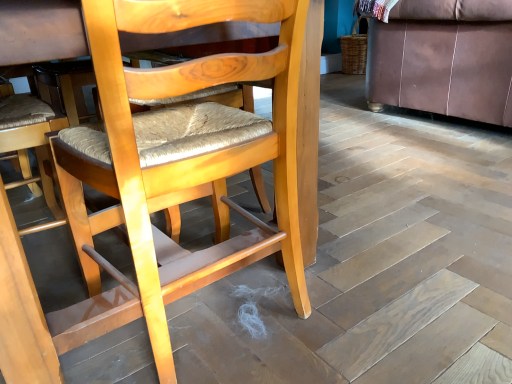
Image resolution: width=512 pixels, height=384 pixels. What do you see at coordinates (444, 59) in the screenshot?
I see `brown leather couch at right` at bounding box center [444, 59].

Locate an element on the screen. Image resolution: width=512 pixels, height=384 pixels. brown leather couch at right is located at coordinates (444, 59).

The width and height of the screenshot is (512, 384). In order to click on light brown wood chair at center in this screenshot , I will do `click(168, 180)`.

Measure the distance between point (139, 19) and camera.

A distance of 58.60 centimeters exists between point (139, 19) and camera.

Describe the element at coordinates (168, 180) in the screenshot. I see `light brown wood chair at center` at that location.

This screenshot has width=512, height=384. What are the coordinates of `brown leather couch at right` in the screenshot? It's located at (x=444, y=59).

Based on the photo, considering the positions of objects brown leather couch at right and light brown wood chair at center in the image provided, who is more to the right, brown leather couch at right or light brown wood chair at center?

brown leather couch at right.

From the picture: Which object is more forward, brown leather couch at right or light brown wood chair at center?

Positioned in front is light brown wood chair at center.

Which is closer to the camera, (x=432, y=77) or (x=293, y=94)?

Positioned in front is point (x=293, y=94).

From the image's perspective, is brown leather couch at right over light brown wood chair at center?

Correct, brown leather couch at right appears higher than light brown wood chair at center in the image.

In the scene shown: From a real-world perspective, is brown leather couch at right on light brown wood chair at center?

Yes, from a real-world perspective, brown leather couch at right is on top of light brown wood chair at center.

Is brown leather couch at right wider than light brown wood chair at center?

Indeed, brown leather couch at right has a greater width compared to light brown wood chair at center.

Between brown leather couch at right and light brown wood chair at center, which one has less height?

Standing shorter between the two is brown leather couch at right.

Can you confirm if brown leather couch at right is bigger than light brown wood chair at center?

Indeed, brown leather couch at right has a larger size compared to light brown wood chair at center.

Can we say brown leather couch at right lies outside light brown wood chair at center?

Yes, brown leather couch at right is located beyond the bounds of light brown wood chair at center.

From the picture: Is the surface of brown leather couch at right in direct contact with light brown wood chair at center?

No, brown leather couch at right is not with light brown wood chair at center.

Is brown leather couch at right oriented towards light brown wood chair at center?

No, brown leather couch at right is not facing towards light brown wood chair at center.

Measure the distance from brown leather couch at right to light brown wood chair at center.

5.76 feet.

Where is `studio couch that is on the right side of light brown wood chair at center`? The width and height of the screenshot is (512, 384). studio couch that is on the right side of light brown wood chair at center is located at coordinates (444, 59).

Is light brown wood chair at center to the left of brown leather couch at right from the viewer's perspective?

Yes.

Considering the positions of objects light brown wood chair at center and brown leather couch at right in the image provided, who is in front, light brown wood chair at center or brown leather couch at right?

light brown wood chair at center.

Which point is more forward, (291,51) or (378,51)?

The point (291,51) is in front.

From the image's perspective, is light brown wood chair at center above brown leather couch at right?

No.

Consider the image. From a real-world perspective, which is physically below, light brown wood chair at center or brown leather couch at right?

light brown wood chair at center, from a real-world perspective.

Considering the relative sizes of light brown wood chair at center and brown leather couch at right in the image provided, is light brown wood chair at center thinner than brown leather couch at right?

Indeed, light brown wood chair at center has a lesser width compared to brown leather couch at right.

Consider the image. Is light brown wood chair at center taller than brown leather couch at right?

Yes.

Who is smaller, light brown wood chair at center or brown leather couch at right?

light brown wood chair at center.

Can we say light brown wood chair at center lies outside brown leather couch at right?

Yes, light brown wood chair at center is not within brown leather couch at right.

Consider the image. Is light brown wood chair at center directly adjacent to brown leather couch at right?

light brown wood chair at center and brown leather couch at right are clearly separated.

Is light brown wood chair at center turned away from brown leather couch at right?

No, light brown wood chair at center is not facing the opposite direction of brown leather couch at right.

What's the angular difference between light brown wood chair at center and brown leather couch at right's facing directions?

90.9 degrees separate the facing orientations of light brown wood chair at center and brown leather couch at right.

How distant is light brown wood chair at center from brown leather couch at right?

The distance of light brown wood chair at center from brown leather couch at right is 5.76 feet.

Where is `studio couch above the light brown wood chair at center (from a real-world perspective)`? The width and height of the screenshot is (512, 384). studio couch above the light brown wood chair at center (from a real-world perspective) is located at coordinates (444, 59).

Find the location of a particular element. The image size is (512, 384). studio couch above the light brown wood chair at center (from a real-world perspective) is located at coordinates (444, 59).

Find the location of a particular element. This screenshot has height=384, width=512. chair lying in front of the brown leather couch at right is located at coordinates (168, 180).